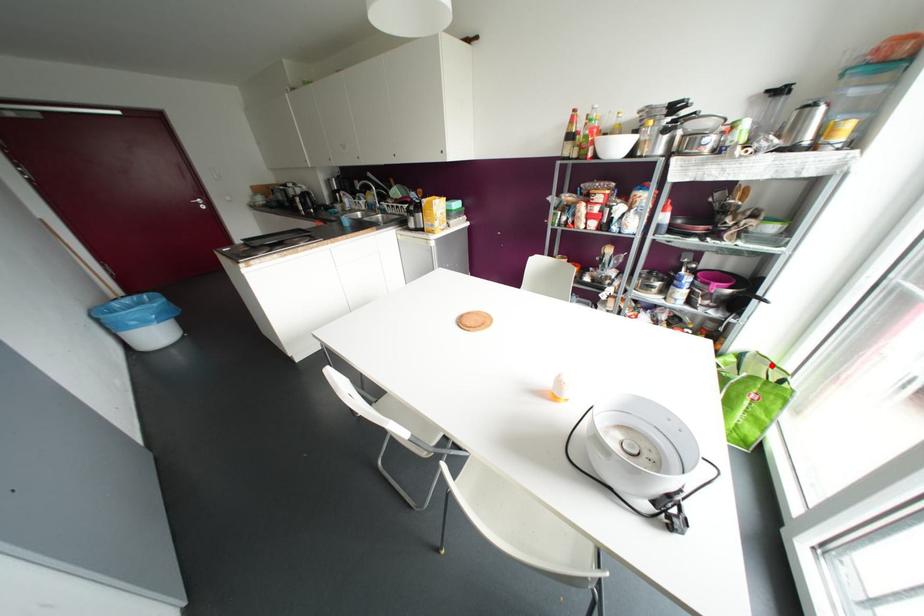
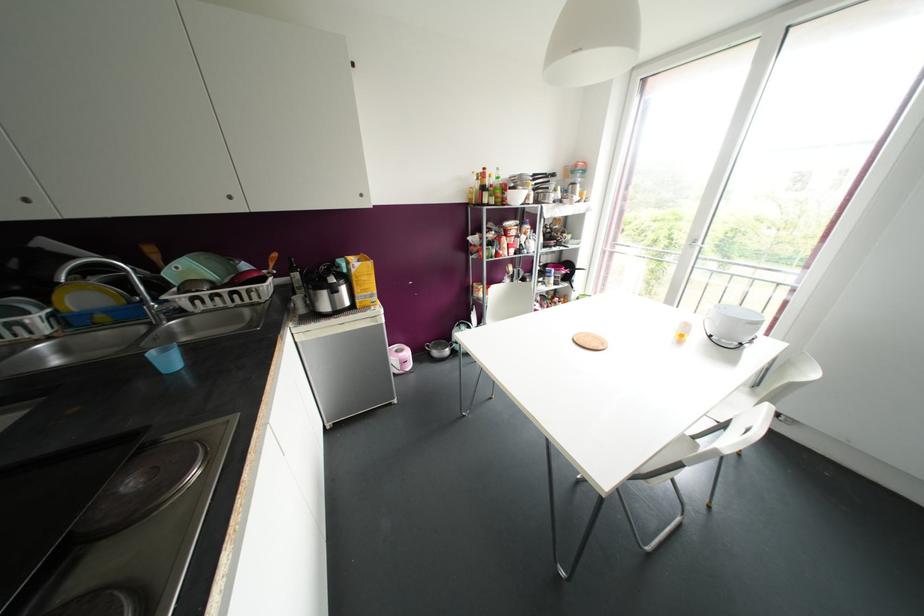
Question: I am providing you with two images of the same scene from different viewpoints. A red point is marked on the first image. At the location where the point appears in image 1, is it still visible in image 2?

Choices:
 (A) Yes
 (B) No

Answer: (B)